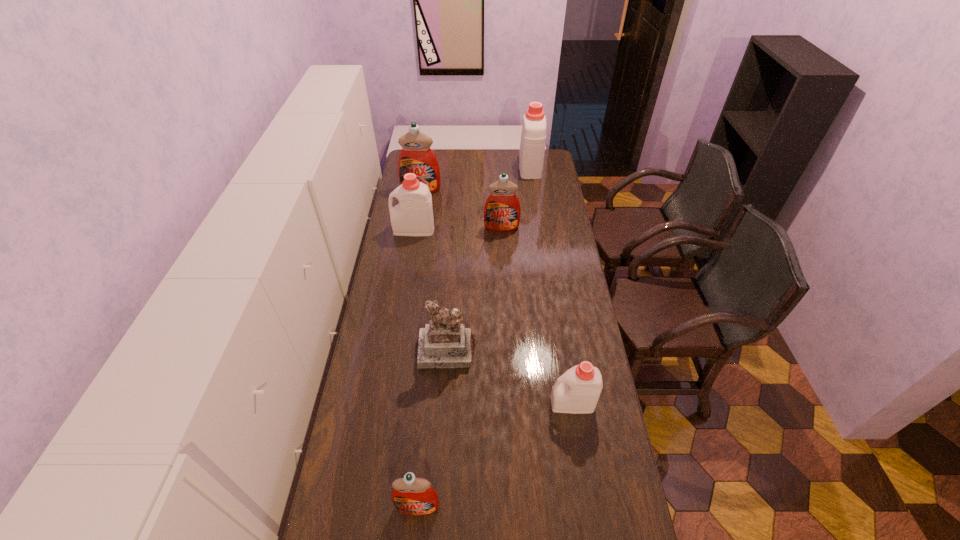
You are a GUI agent. You are given a task and a screenshot of the screen. Output one action in this format:
    pyautogui.click(x=<x>, y=<y>)
    Task: Click on the farthest detergent
    
    Given the screenshot: What is the action you would take?
    pyautogui.click(x=533, y=136)

The height and width of the screenshot is (540, 960). I want to click on the biggest white detergent, so click(533, 136).

The height and width of the screenshot is (540, 960). I want to click on the biggest red detergent, so click(416, 156).

This screenshot has height=540, width=960. Find the location of `the second farthest object`. the second farthest object is located at coordinates (416, 156).

Locate an element on the screen. The height and width of the screenshot is (540, 960). the second farthest red detergent is located at coordinates (502, 210).

You are a GUI agent. You are given a task and a screenshot of the screen. Output one action in this format:
    pyautogui.click(x=<x>, y=<y>)
    Task: Click on the second smallest red detergent
    The image size is (960, 540).
    Given the screenshot: What is the action you would take?
    pyautogui.click(x=502, y=210)

The width and height of the screenshot is (960, 540). Identify the location of the second nearest white detergent. (413, 216).

Find the location of `the leftmost white detergent`. the leftmost white detergent is located at coordinates (413, 216).

The height and width of the screenshot is (540, 960). I want to click on figurine, so click(x=445, y=342).

Identify the location of the sixth farthest object. (577, 391).